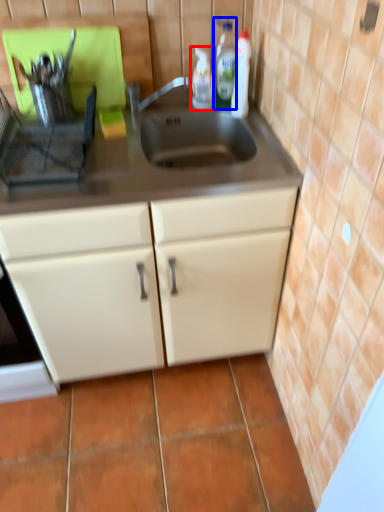
Question: Which object is closer to the camera taking this photo, bottle (highlighted by a red box) or bottle (highlighted by a blue box)?

Choices:
 (A) bottle
 (B) bottle

Answer: (B)